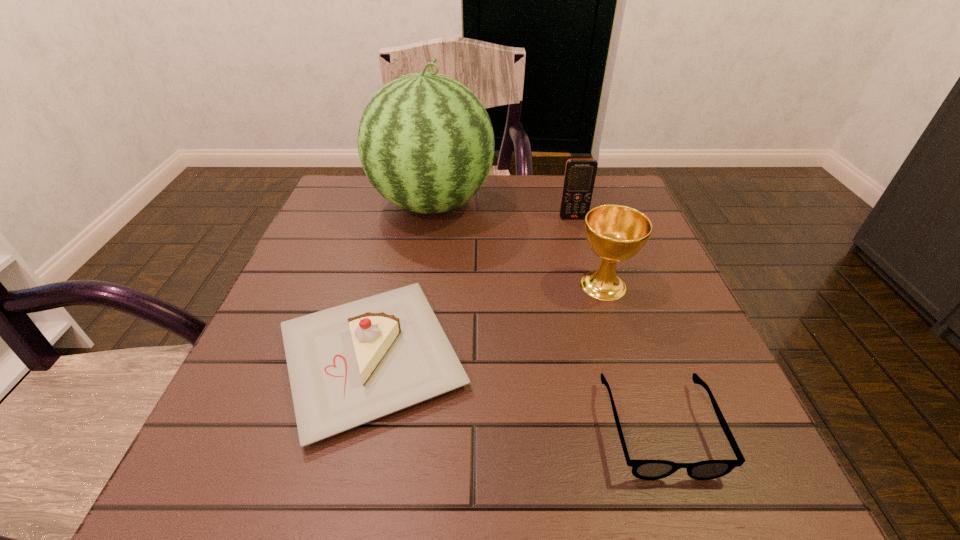
Identify the location of the tallest object. This screenshot has height=540, width=960. (426, 143).

Where is `cellular telephone`? The height and width of the screenshot is (540, 960). cellular telephone is located at coordinates (580, 174).

The image size is (960, 540). I want to click on chalice, so click(x=615, y=233).

This screenshot has width=960, height=540. In order to click on the second shortest object in this screenshot , I will do `click(348, 365)`.

At what (x,y) coordinates should I click in order to perform the action: click on spectacles. Please return your answer as a coordinate pair (x, y). Looking at the image, I should click on (642, 469).

The width and height of the screenshot is (960, 540). I want to click on blank space located on the right of the tallest object, so click(583, 204).

Image resolution: width=960 pixels, height=540 pixels. I want to click on vacant area located on the screen of the cellular telephone, so click(x=593, y=289).

Where is `vacant space located 0.110m on the back of the chalice`? The width and height of the screenshot is (960, 540). vacant space located 0.110m on the back of the chalice is located at coordinates (588, 237).

Locate an element on the screen. The image size is (960, 540). vacant space located on the back of the cake is located at coordinates coord(407,206).

You are a GUI agent. You are given a task and a screenshot of the screen. Output one action in this format:
    pyautogui.click(x=<x>, y=<y>)
    Task: Click on the watermelon located at the far edge
    
    Given the screenshot: What is the action you would take?
    point(426,143)